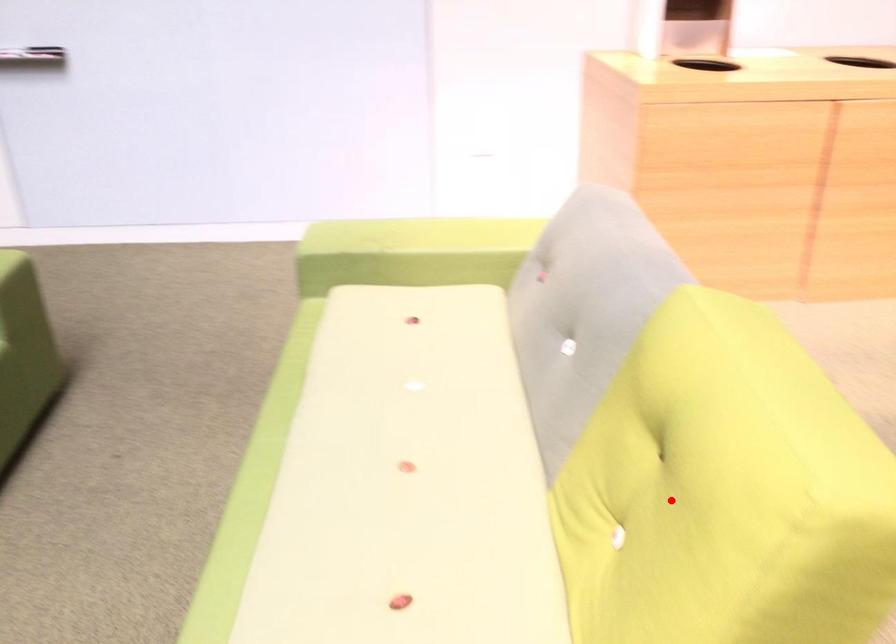
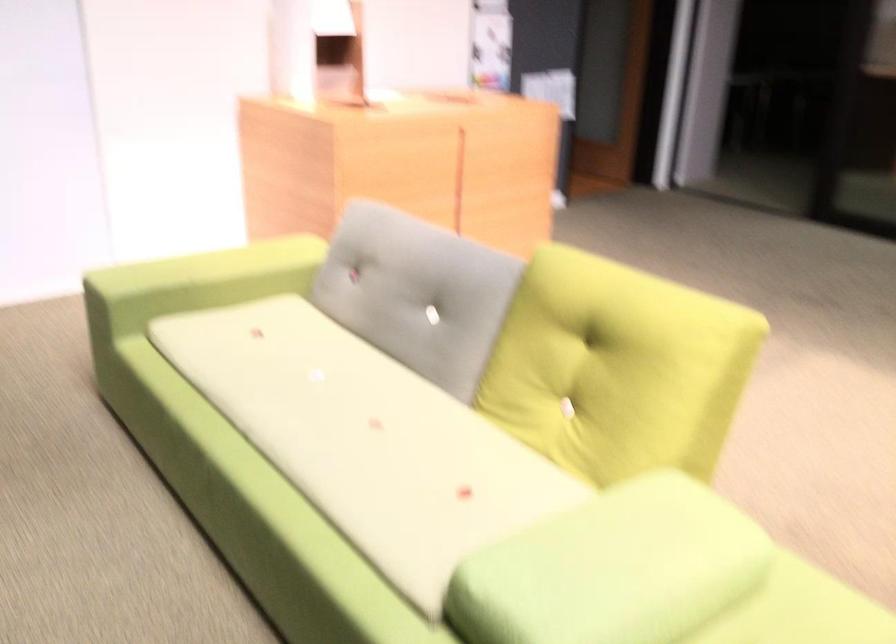
Question: I am providing you with two images of the same scene from different viewpoints. Image1 has a red point marked. In image2, the corresponding 3D location appears at what relative position? Reply with the corresponding letter.

Choices:
 (A) Closer
 (B) Farther

Answer: (B)